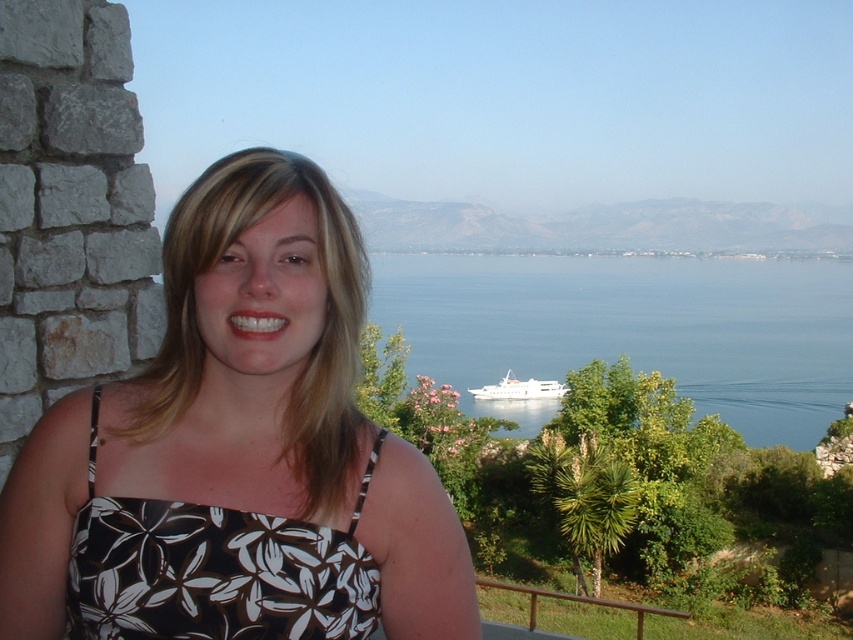
What do you see at coordinates (213, 570) in the screenshot? I see `black floral fabric dress at left` at bounding box center [213, 570].

Which is behind, point (294, 589) or point (538, 380)?

The point (538, 380) is more distant.

Find the location of a particular element. This screenshot has width=853, height=640. black floral fabric dress at left is located at coordinates (213, 570).

Does blue water at center have a smaller size compared to black floral fabric dress at left?

Incorrect, blue water at center is not smaller in size than black floral fabric dress at left.

Is point (741, 275) positioned before point (199, 557)?

No, it is behind (199, 557).

Does point (646, 340) lie behind point (222, 592)?

Yes, point (646, 340) is farther from viewer.

Locate an element on the screen. The width and height of the screenshot is (853, 640). blue water at center is located at coordinates (x=633, y=330).

Can you confirm if floral print dress at center is shorter than blue water at center?

Correct, floral print dress at center is not as tall as blue water at center.

Is floral print dress at center thinner than blue water at center?

Yes.

Between point (350, 276) and point (698, 282), which one is positioned behind?

Point (698, 282)

This screenshot has width=853, height=640. In order to click on floral print dress at center in this screenshot , I will do `click(236, 452)`.